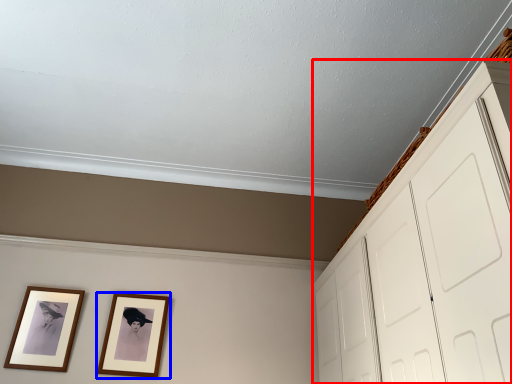
Question: Which object appears closest to the camera in this image, dresser (highlighted by a red box) or picture frame (highlighted by a blue box)?

Choices:
 (A) dresser
 (B) picture frame

Answer: (A)